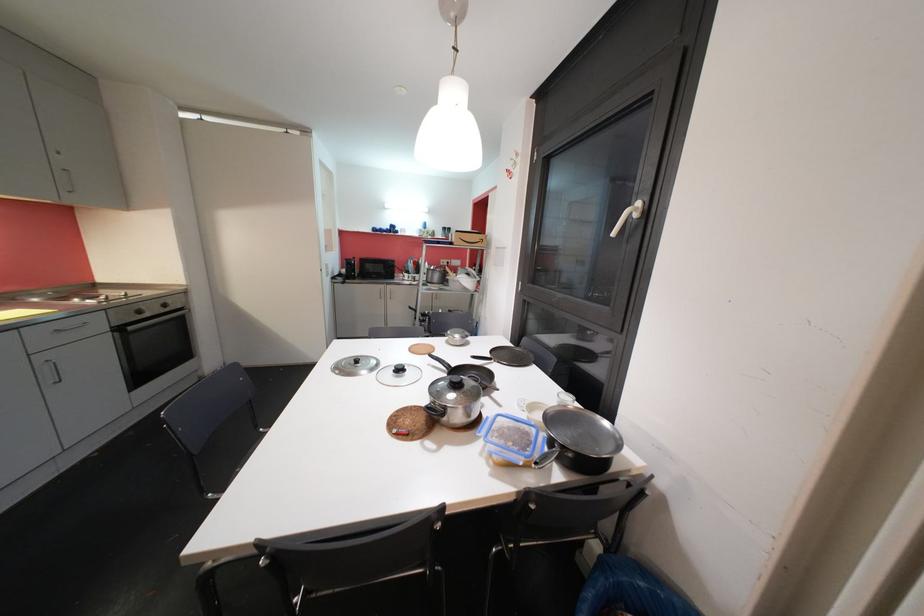
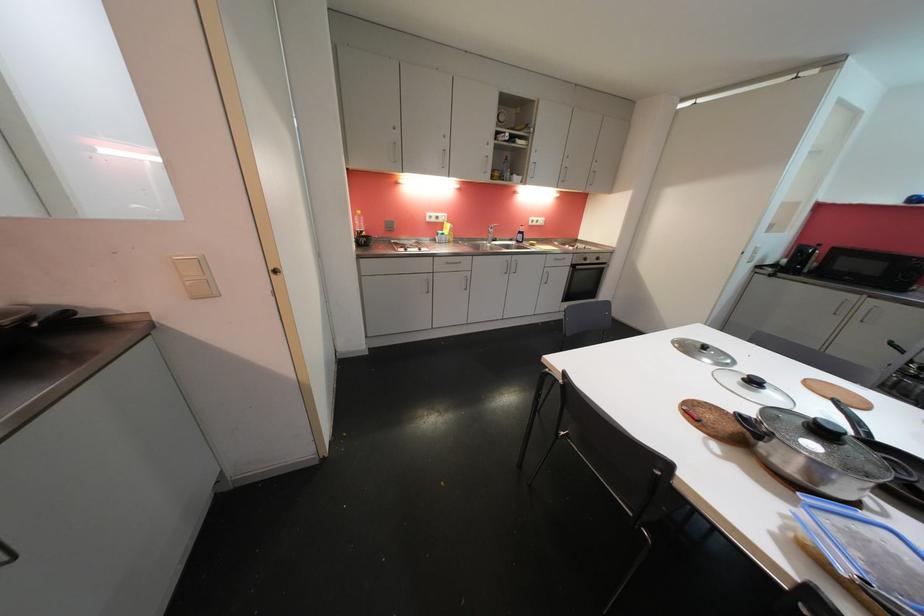
The point at (358, 365) is marked in the first image. Where is the corresponding point in the second image?

(703, 349)